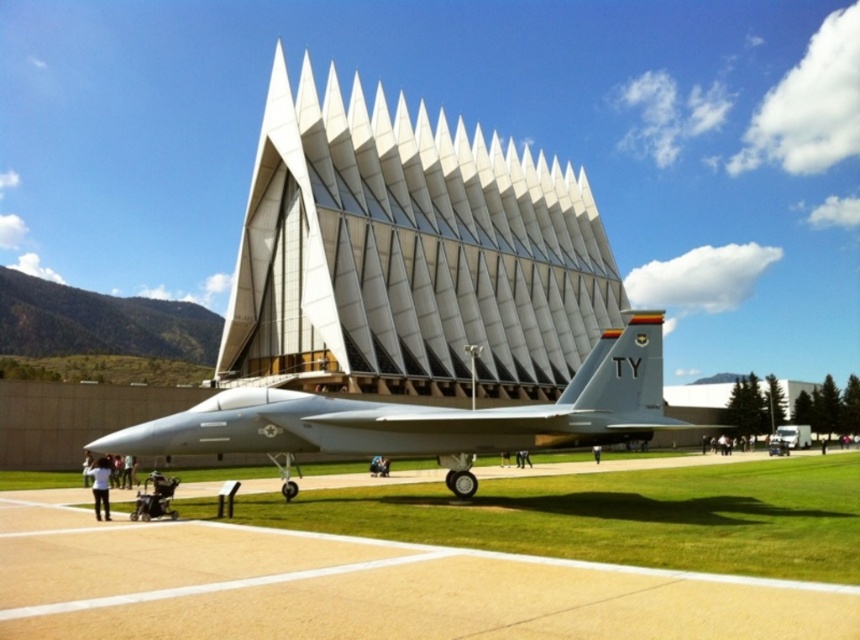
Based on the scene description, what is located at the coordinates point (408, 256)?

The white matte building at center is located at point (408, 256).

You are a pilot who just landed your fighter jet. You need to walk from the white matte building at center to the smooth concrete tarmac at center. Which direction should you face to walk towards the tarmac?

You should face to the left to walk towards the smooth concrete tarmac at center from the white matte building at center, since the white matte building at center is to the right of the smooth concrete tarmac at center.